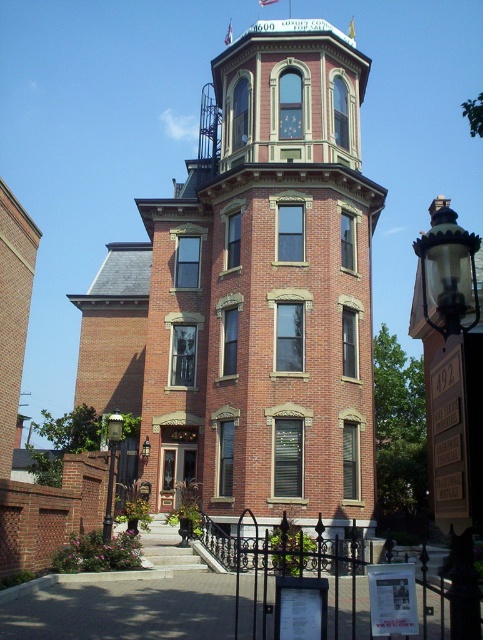
Who is positioned more to the left, matte glass clock at upper center or matte black lamp at upper center?

Positioned to the left is matte black lamp at upper center.

Which is behind, point (293, 109) or point (148, 445)?

The point (293, 109) is more distant.

The width and height of the screenshot is (483, 640). What are the coordinates of `matte glass clock at upper center` in the screenshot? It's located at (289, 120).

Which is more to the left, black metal streetlamp at lower left or matte black lamp at upper center?

black metal streetlamp at lower left is more to the left.

You are a GUI agent. You are given a task and a screenshot of the screen. Output one action in this format:
    pyautogui.click(x=<x>, y=<y>)
    Task: Click on the black metal streetlamp at lower left
    The width and height of the screenshot is (483, 640).
    Given the screenshot: What is the action you would take?
    pyautogui.click(x=112, y=467)

At what (x,y) coordinates should I click in order to perform the action: click on black metal streetlamp at lower left. Please return your answer as a coordinate pair (x, y). This screenshot has height=640, width=483. Looking at the image, I should click on (112, 467).

Find the location of a particular element. black metal streetlamp at lower left is located at coordinates (112, 467).

Can you confirm if black metal streetlamp at lower left is taller than matte glass clock at upper center?

Yes.

I want to click on black metal streetlamp at lower left, so click(x=112, y=467).

Is point (105, 429) in front of point (290, 122)?

No, it is behind (290, 122).

Where is `black metal streetlamp at lower left`? The image size is (483, 640). black metal streetlamp at lower left is located at coordinates (112, 467).